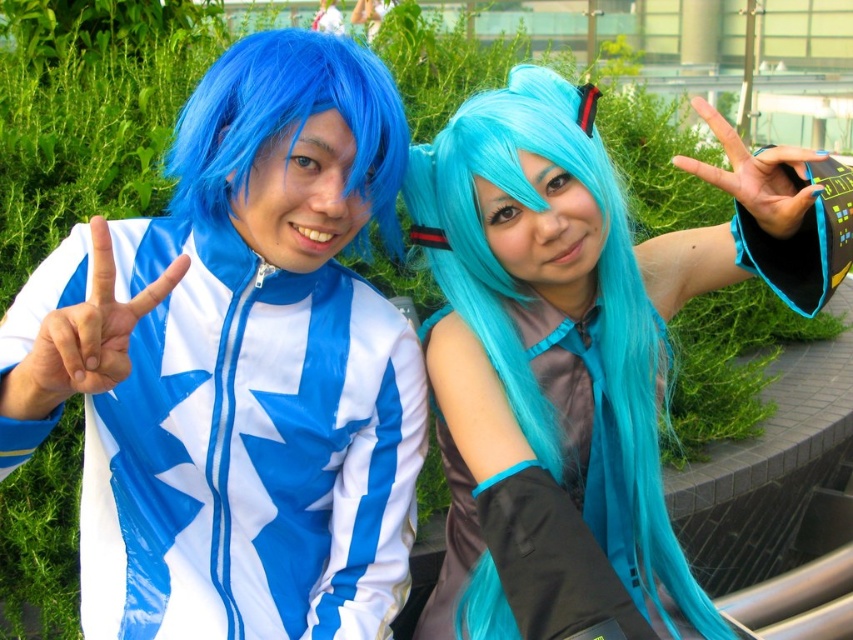
Is teal glossy wig at center to the right of satin teal dress at center from the viewer's perspective?

Correct, you'll find teal glossy wig at center to the right of satin teal dress at center.

Where is `teal glossy wig at center`? This screenshot has height=640, width=853. teal glossy wig at center is located at coordinates (579, 349).

This screenshot has height=640, width=853. What are the coordinates of `teal glossy wig at center` in the screenshot? It's located at (579, 349).

Looking at this image, which is above, shiny plastic jacket at center or blue synthetic wig at left?

blue synthetic wig at left is above.

Does point (136, 468) lie behind point (206, 157)?

Yes.

Identify the location of shiny plastic jacket at center. The width and height of the screenshot is (853, 640). (248, 451).

Which is in front, point (535, 560) or point (294, 573)?

Point (535, 560) is in front.

Is point (656, 547) farther from camera compared to point (206, 392)?

That is True.

Consider the image. Measure the distance between teal glossy wig at center and camera.

teal glossy wig at center is 1.40 meters from camera.

At what (x,y) coordinates should I click in order to perform the action: click on teal glossy wig at center. Please return your answer as a coordinate pair (x, y). Looking at the image, I should click on (579, 349).